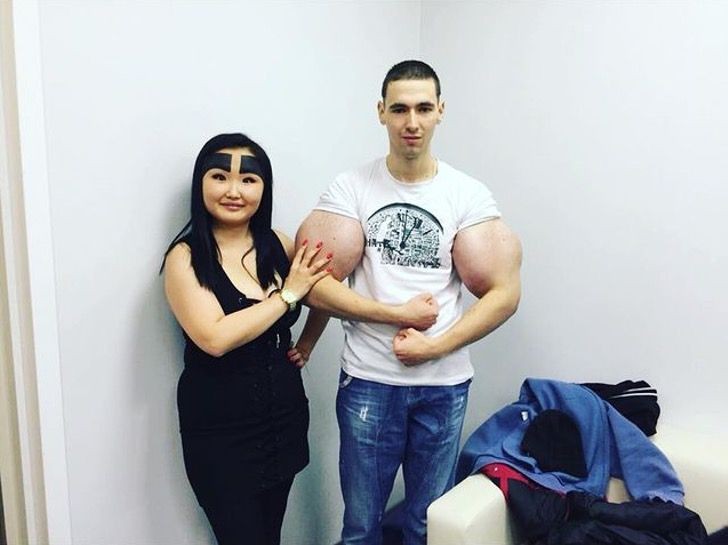
Where is `discarded clothing`? This screenshot has height=545, width=728. discarded clothing is located at coordinates (550, 442), (636, 403), (587, 423), (590, 526).